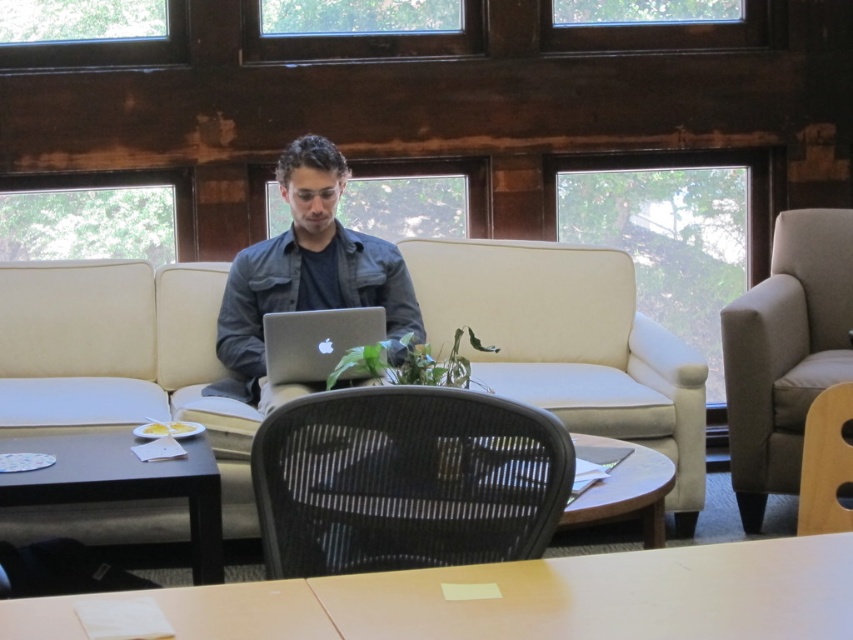
In the scene shown: You are a visitor in this lounge and want to sit down. You see the gray fabric armchair at right and the black wood table at lower left. Which one is closer to you?

The gray fabric armchair at right is closer to you since it is further to the viewer than the black wood table at lower left.

You are trying to decide between sitting on the beige fabric couch at center and the wooden chair at lower right. Which one has more space for your legs?

The beige fabric couch at center is wider than the wooden chair at lower right, so it likely offers more legroom.

Looking at this image, you are standing at the camera position in the lounge. There are two points marked in the image, one at coordinates point (368, 595) and another at point (799, 294). Which point is nearer to you?

Point (368, 595) is closer to the camera than point (799, 294), so the point nearer to you is point (368, 595).